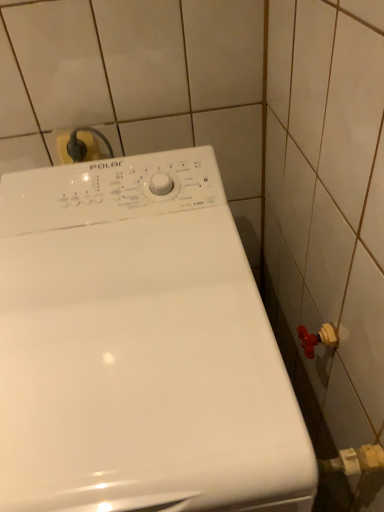
Identify the location of yellow plastic plug at upper left. tap(90, 145).

Describe the element at coordinates (90, 145) in the screenshot. The height and width of the screenshot is (512, 384). I see `yellow plastic plug at upper left` at that location.

The image size is (384, 512). Describe the element at coordinates (139, 346) in the screenshot. I see `white glossy washing machine at center` at that location.

The width and height of the screenshot is (384, 512). What are the coordinates of `white glossy washing machine at center` in the screenshot? It's located at (139, 346).

You are a GUI agent. You are given a task and a screenshot of the screen. Output one action in this format:
    pyautogui.click(x=<x>, y=<y>)
    Task: Click on the yellow plastic plug at upper left
    
    Given the screenshot: What is the action you would take?
    pyautogui.click(x=90, y=145)

Which is more to the left, white glossy washing machine at center or yellow plastic plug at upper left?

yellow plastic plug at upper left is more to the left.

Is the position of white glossy washing machine at center more distant than that of yellow plastic plug at upper left?

No.

Is point (113, 418) in front of point (69, 158)?

Yes, it is in front of point (69, 158).

From the image's perspective, between white glossy washing machine at center and yellow plastic plug at upper left, who is located below?

white glossy washing machine at center is shown below in the image.

From a real-world perspective, is white glossy washing machine at center on yellow plastic plug at upper left?

No, from a real-world perspective, white glossy washing machine at center is not over yellow plastic plug at upper left

Is white glossy washing machine at center thinner than yellow plastic plug at upper left?

No.

In terms of height, does white glossy washing machine at center look taller or shorter compared to yellow plastic plug at upper left?

Considering their sizes, white glossy washing machine at center has more height than yellow plastic plug at upper left.

Between white glossy washing machine at center and yellow plastic plug at upper left, which one has larger size?

Bigger between the two is white glossy washing machine at center.

Would you say white glossy washing machine at center contains yellow plastic plug at upper left?

No, yellow plastic plug at upper left is not surrounded by white glossy washing machine at center.

Would you say white glossy washing machine at center is a long distance from yellow plastic plug at upper left?

No, white glossy washing machine at center is not far away from yellow plastic plug at upper left.

Is white glossy washing machine at center positioned with its back to yellow plastic plug at upper left?

Yes.

How different are the orientations of white glossy washing machine at center and yellow plastic plug at upper left in degrees?

There is a 0.00159-degree angle between the facing directions of white glossy washing machine at center and yellow plastic plug at upper left.

Where is `electric outlet located above the white glossy washing machine at center (from a real-world perspective)`? The height and width of the screenshot is (512, 384). electric outlet located above the white glossy washing machine at center (from a real-world perspective) is located at coordinates (90, 145).

Does yellow plastic plug at upper left appear on the left side of white glossy washing machine at center?

Indeed, yellow plastic plug at upper left is positioned on the left side of white glossy washing machine at center.

Is yellow plastic plug at upper left further to camera compared to white glossy washing machine at center?

That is True.

Is point (90, 140) closer to camera compared to point (239, 283)?

No, (90, 140) is further to viewer.

From the image's perspective, is yellow plastic plug at upper left under white glossy washing machine at center?

No, from the image's perspective, yellow plastic plug at upper left is not below white glossy washing machine at center.

From a real-world perspective, does yellow plastic plug at upper left sit lower than white glossy washing machine at center?

No, from a real-world perspective, yellow plastic plug at upper left is not beneath white glossy washing machine at center.

Is yellow plastic plug at upper left wider than white glossy washing machine at center?

In fact, yellow plastic plug at upper left might be narrower than white glossy washing machine at center.

Is yellow plastic plug at upper left taller or shorter than white glossy washing machine at center?

In the image, yellow plastic plug at upper left appears to be shorter than white glossy washing machine at center.

Considering the sizes of objects yellow plastic plug at upper left and white glossy washing machine at center in the image provided, who is bigger, yellow plastic plug at upper left or white glossy washing machine at center?

white glossy washing machine at center.

Choose the correct answer: Is yellow plastic plug at upper left inside white glossy washing machine at center or outside it?

yellow plastic plug at upper left lies outside white glossy washing machine at center.

Is yellow plastic plug at upper left next to white glossy washing machine at center?

No, yellow plastic plug at upper left is not with white glossy washing machine at center.

Is yellow plastic plug at upper left positioned with its back to white glossy washing machine at center?

No, white glossy washing machine at center is not at the back of yellow plastic plug at upper left.

In the scene shown: How many degrees apart are the facing directions of yellow plastic plug at upper left and white glossy washing machine at center?

They differ by 0.00159 degrees in their facing directions.

Where is `electric outlet on the left side of white glossy washing machine at center`? Image resolution: width=384 pixels, height=512 pixels. electric outlet on the left side of white glossy washing machine at center is located at coordinates (90, 145).

At what (x,y) coordinates should I click in order to perform the action: click on electric outlet above the white glossy washing machine at center (from the image's perspective). Please return your answer as a coordinate pair (x, y). This screenshot has height=512, width=384. Looking at the image, I should click on (90, 145).

Locate an element on the screen. The image size is (384, 512). washing machine on the right of yellow plastic plug at upper left is located at coordinates (139, 346).